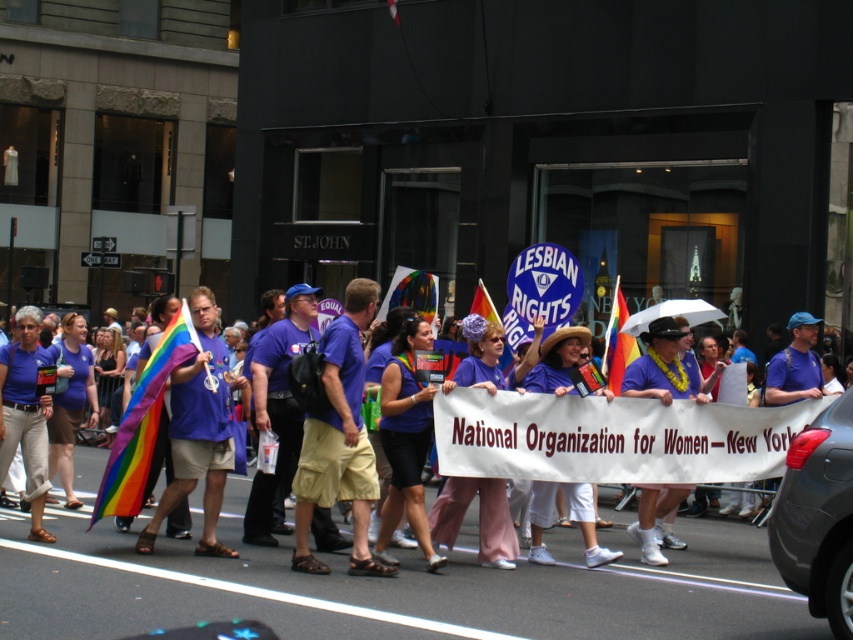
Which is more to the right, purple fabric shirt at center or purple cotton shirt at center?

purple fabric shirt at center is more to the right.

Find the location of a particular element. The height and width of the screenshot is (640, 853). purple fabric shirt at center is located at coordinates (610, 436).

Is purple fabric at center bigger than rainbow fabric flag at left?

No, purple fabric at center is not bigger than rainbow fabric flag at left.

Is purple fabric at center smaller than rainbow fabric flag at left?

Correct, purple fabric at center occupies less space than rainbow fabric flag at left.

Where is `purple fabric at center`? The image size is (853, 640). purple fabric at center is located at coordinates (479, 518).

Can you confirm if purple fabric shirt at center is positioned below matte blue shirt at center?

No.

Is point (579, 452) behind point (22, 324)?

No.

Who is more forward, (x=680, y=472) or (x=0, y=435)?

Point (x=680, y=472) is more forward.

The width and height of the screenshot is (853, 640). Identify the location of purple fabric shirt at center. coord(610,436).